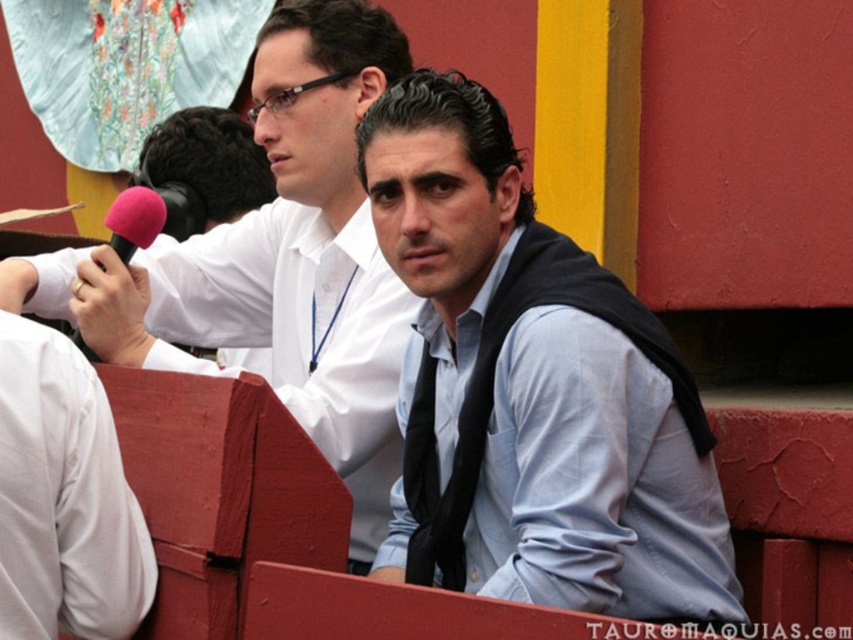
Can you confirm if light blue shirt at center is positioned above matte black tie at center?

Actually, light blue shirt at center is below matte black tie at center.

Between point (422, 116) and point (219, 227), which one is positioned behind?

Point (219, 227)

Which is in front, point (416, 161) or point (357, 212)?

Point (416, 161) is in front.

Identify the location of light blue shirt at center. (531, 388).

Does matte black tie at center appear on the left side of pink fabric microphone at upper left?

Incorrect, matte black tie at center is not on the left side of pink fabric microphone at upper left.

Between matte black tie at center and pink fabric microphone at upper left, which one appears on the left side from the viewer's perspective?

Positioned to the left is pink fabric microphone at upper left.

Who is more distant from viewer, [335,170] or [136,234]?

The point [335,170] is more distant.

The width and height of the screenshot is (853, 640). What are the coordinates of `matte black tie at center` in the screenshot? It's located at (276, 260).

Between point (427, 104) and point (138, 218), which one is positioned in front?

Positioned in front is point (427, 104).

Is light blue shirt at center positioned in front of pink fabric microphone at upper left?

Yes, light blue shirt at center is closer to the viewer.

Is point (593, 394) farther from viewer compared to point (157, 232)?

No, it is not.

The width and height of the screenshot is (853, 640). Find the location of `light blue shirt at center`. light blue shirt at center is located at coordinates point(531,388).